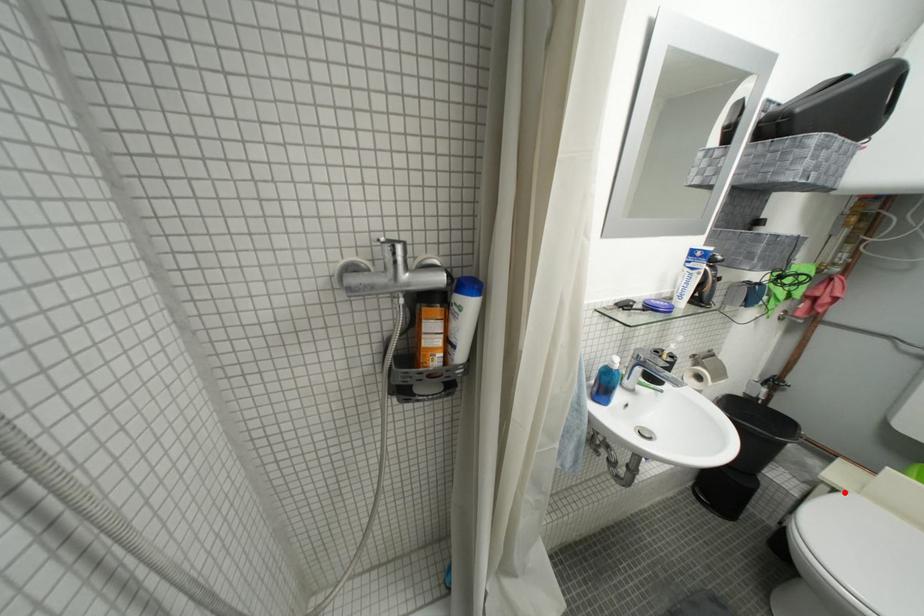
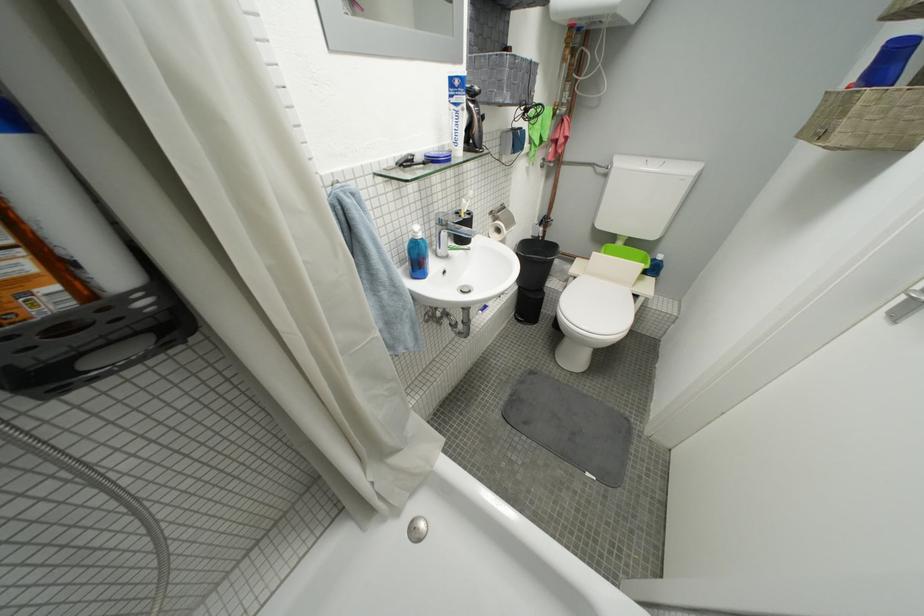
Question: I am providing you with two images of the same scene from different viewpoints. Given a red point in image1, look at the same physical point in image2. Is it:

Choices:
 (A) Closer to the viewpoint
 (B) Farther from the viewpoint

Answer: (A)